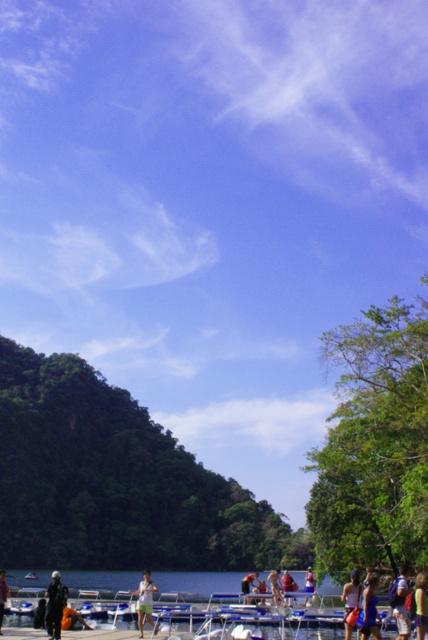
Does green fabric dress at lower right come behind green fabric shirt at lower center?

Yes, it is.

Does green fabric dress at lower right have a greater width compared to green fabric shirt at lower center?

No, green fabric dress at lower right is not wider than green fabric shirt at lower center.

This screenshot has height=640, width=428. What do you see at coordinates (369, 609) in the screenshot?
I see `green fabric dress at lower right` at bounding box center [369, 609].

Identify the location of green fabric dress at lower right. (369, 609).

Which of these two, green fabric shorts at center or red fabric person at lower center, stands shorter?

With less height is green fabric shorts at center.

Is point (154, 589) positioned before point (270, 586)?

Yes, point (154, 589) is closer to viewer.

Is point (145, 579) more distant than point (270, 589)?

No.

Identify the location of green fabric shorts at center. This screenshot has width=428, height=640. (145, 602).

Between point (400, 573) and point (243, 579), which one is positioned in front?

Point (400, 573) is in front.

Can you confirm if dark blue fabric bag at lower right is positioned above light brown fabric shirt at center?

Yes, dark blue fabric bag at lower right is above light brown fabric shirt at center.

Which is behind, point (404, 566) or point (244, 593)?

The point (244, 593) is more distant.

The image size is (428, 640). I want to click on dark blue fabric bag at lower right, so click(x=401, y=602).